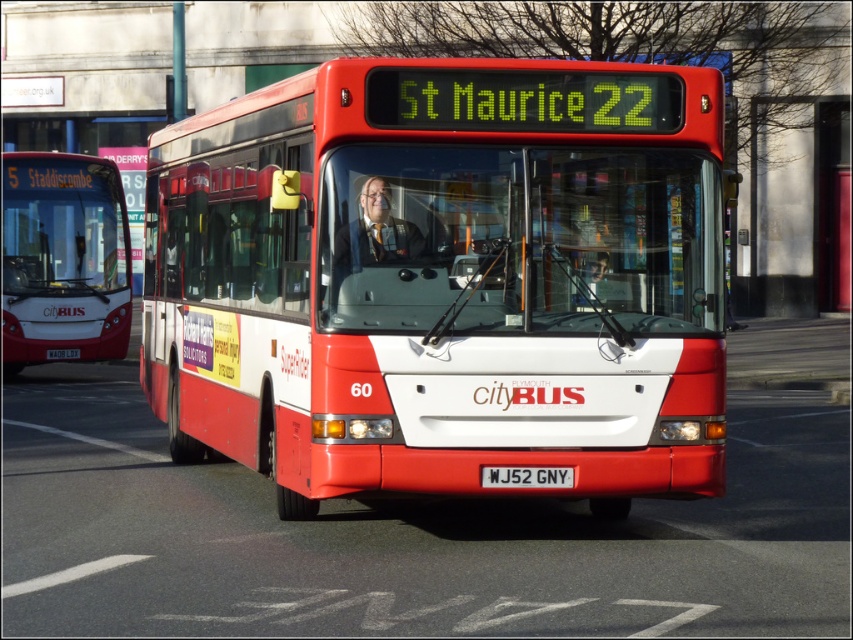
You are a bus driver checking the license plate of the matte red bus at center. Can you confirm if the white plastic license plate at center is smaller than the bus itself?

The matte red bus at center is larger in size than the white plastic license plate at center, so yes, the license plate is smaller than the bus.

You are a bus driver who just got off the matte black bus at left and needs to check the license plate details on the white plastic license plate at center. Can you reach the license plate without using a ladder?

The matte black bus at left is taller than the white plastic license plate at center, so the license plate is lower and within reach without needing a ladder.

You are a pedestrian standing in front of the matte red bus at center. You want to look at the white plastic license plate at center. In which direction should you turn your head?

The matte red bus at center is to the left of the white plastic license plate at center, so you should turn your head to the right to look at the white plastic license plate at center.